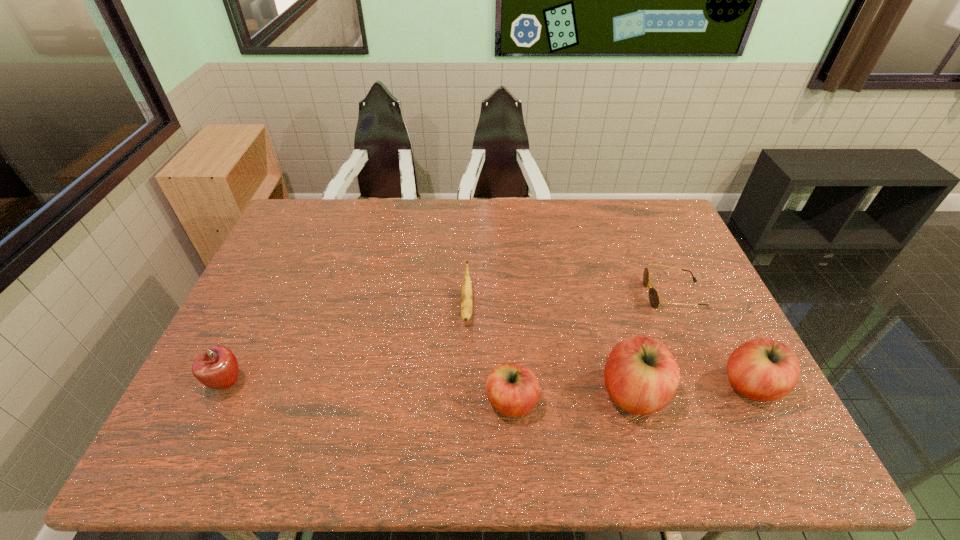
At what (x,y) coordinates should I click in order to perform the action: click on object located at the near right corner. Please return your answer as a coordinate pair (x, y). The image size is (960, 540). Looking at the image, I should click on (763, 369).

The image size is (960, 540). What are the coordinates of `free space at the far edge of the desktop` in the screenshot? It's located at (336, 224).

In the image, there is a desktop. Identify the location of vacant region at the near edge. This screenshot has height=540, width=960. (269, 417).

Find the location of a particular element. The height and width of the screenshot is (540, 960). free space at the left edge of the desktop is located at coordinates (265, 291).

This screenshot has width=960, height=540. In the image, there is a desktop. Identify the location of free space at the right edge. (698, 372).

You are a GUI agent. You are given a task and a screenshot of the screen. Output one action in this format:
    pyautogui.click(x=<x>, y=<y>)
    Task: Click on the vacant space that's between the shortest object and the rightmost apple
    The height and width of the screenshot is (540, 960).
    Given the screenshot: What is the action you would take?
    pyautogui.click(x=712, y=340)

Image resolution: width=960 pixels, height=540 pixels. I want to click on free area in between the fifth tallest object and the third object from left to right, so click(x=490, y=354).

You are a GUI agent. You are given a task and a screenshot of the screen. Output one action in this format:
    pyautogui.click(x=<x>, y=<y>)
    Task: Click on the blank region between the leftmost apple and the sunglasses
    This screenshot has width=960, height=540.
    Given the screenshot: What is the action you would take?
    pyautogui.click(x=451, y=339)

Identify the location of free space that is in between the second shortest object and the sunglasses. (570, 301).

Locate an element on the screen. This screenshot has width=960, height=540. vacant area that lies between the banana and the leftmost apple is located at coordinates (348, 345).